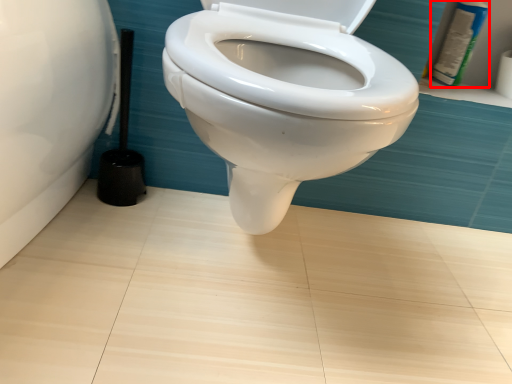
Question: From the image's perspective, considering the relative positions of toiletry (annotated by the red box) and brush in the image provided, where is toiletry (annotated by the red box) located with respect to the staircase?

Choices:
 (A) below
 (B) above

Answer: (B)